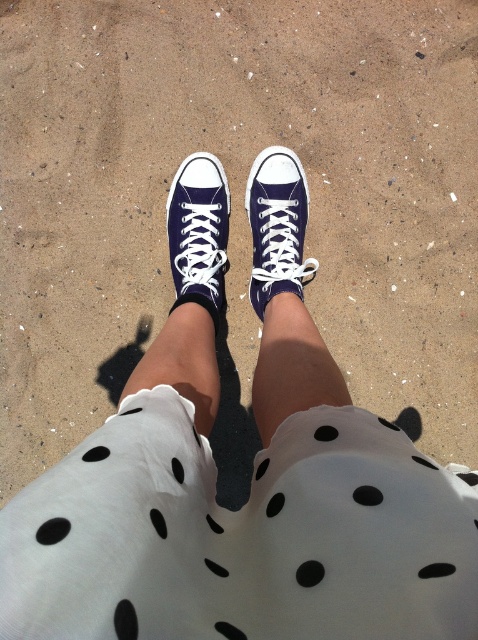
You are designing a shoe rack and need to know if both the matte blue canvas shoe at center and the matte canvas sneaker at center can fit side by side on a shelf that is 12 inches wide. Can they fit?

The matte blue canvas shoe at center might be wider than the matte canvas sneaker at center, so it depends on their combined width. If the total width of both shoes is less than or equal to 12 inches, they can fit side by side.

You are a photographer aiming to capture a detailed shot of the matte blue canvas shoe at center. Given that your camera requires the subject to be within 5 feet for optimal focus, will the shoe be in focus?

The matte blue canvas shoe at center is 5.65 feet away from the camera, which is beyond the 5 feet requirement for optimal focus. Therefore, the shoe may not be in focus.

You are a photographer trying to capture the exact position of the matte blue canvas shoe at center and the matte canvas sneaker at center in the image. Which one is positioned higher from the ground?

The matte blue canvas shoe at center is above the matte canvas sneaker at center, so it is positioned higher from the ground.